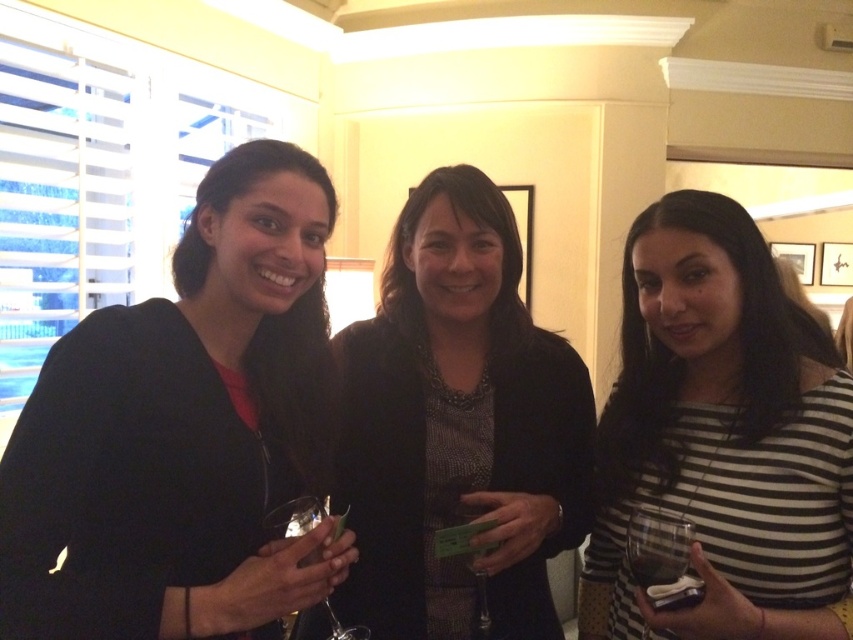
Question: In this image, where is black matte sweater at left located relative to clear glass wine glass at center?

Choices:
 (A) left
 (B) right

Answer: (A)

Question: Which point is closer to the camera?

Choices:
 (A) (339, 625)
 (B) (630, 531)

Answer: (B)

Question: Estimate the real-world distances between objects in this image. Which object is farther from the clear glass wine glass at center?

Choices:
 (A) clear glass wine glass at lower right
 (B) striped cotton shirt at right

Answer: (B)

Question: Estimate the real-world distances between objects in this image. Which object is farther from the clear glass wine glass at lower right?

Choices:
 (A) striped cotton shirt at right
 (B) clear glass wine glass at center

Answer: (B)

Question: From the image, what is the correct spatial relationship of striped cotton shirt at right in relation to matte black blazer at center?

Choices:
 (A) right
 (B) left

Answer: (A)

Question: Can you confirm if black matte sweater at left is thinner than matte black blazer at center?

Choices:
 (A) yes
 (B) no

Answer: (A)